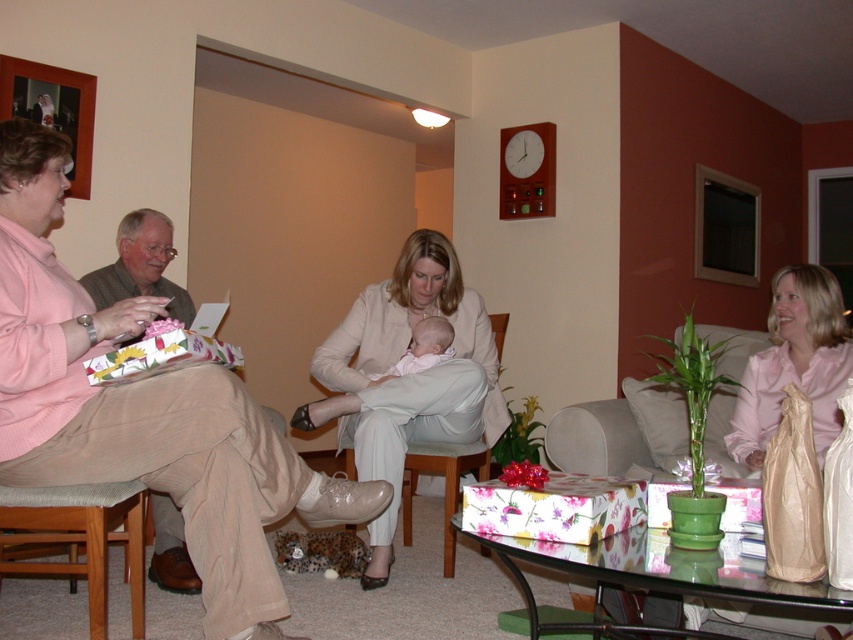
Consider the image. You are a photographer setting up for a family photo. You see the matte pink sweater at left and the soft white baby at center. Which object is positioned closer to you?

The matte pink sweater at left is closer to the viewer than the soft white baby at center.

You are standing at the point marked as point (759, 449) in the image. The room has a ceiling height of 3 meters. If you want to hang a decoration from the ceiling directly above your current position, will it be possible without touching the floor?

The distance of point (759, 449) from viewer is 2.61 meters. Since the ceiling height is 3 meters, hanging a decoration from the ceiling at that point would leave enough space between the decoration and the floor. The decoration would hang 3 meters minus the length of the decoration itself, but assuming standard decoration lengths, it should not touch the floor.